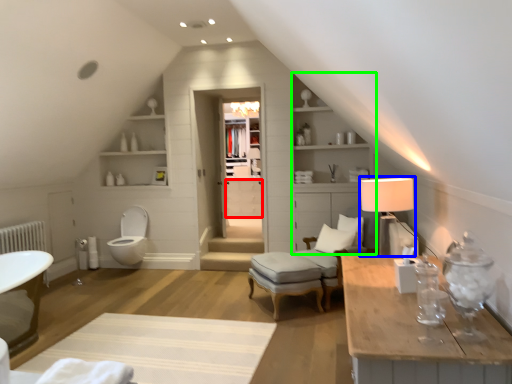
Question: Which is farther away from drawer (highlighted by a red box)? table lamp (highlighted by a blue box) or dresser (highlighted by a green box)?

Choices:
 (A) table lamp
 (B) dresser

Answer: (A)